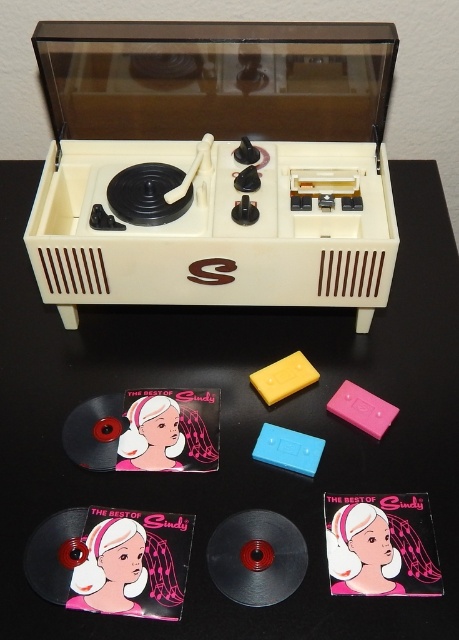
Does matte pink vinyl record at lower left have a lesser width compared to black plastic record at center?

In fact, matte pink vinyl record at lower left might be wider than black plastic record at center.

Identify the location of matte pink vinyl record at lower left. (133, 563).

Is matte pink vinyl record at lower left taller than matte pink vinyl record at lower center?

Indeed, matte pink vinyl record at lower left has a greater height compared to matte pink vinyl record at lower center.

Does point (155, 582) come in front of point (328, 493)?

Yes, point (155, 582) is closer to viewer.

The height and width of the screenshot is (640, 459). I want to click on matte pink vinyl record at lower left, so click(133, 563).

I want to click on matte pink vinyl record at lower left, so click(133, 563).

Can you confirm if beige plastic record player at center is positioned above matte pink vinyl record at lower center?

Correct, beige plastic record player at center is located above matte pink vinyl record at lower center.

Is beige plastic record player at center shorter than matte pink vinyl record at lower center?

No, beige plastic record player at center is not shorter than matte pink vinyl record at lower center.

Is point (122, 140) closer to viewer compared to point (419, 541)?

No, it is behind (419, 541).

Identify the location of beige plastic record player at center. (214, 164).